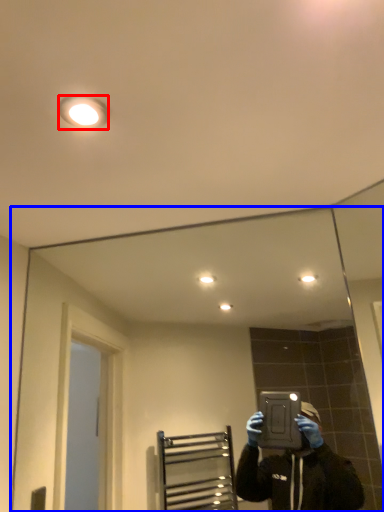
Question: Which object appears farthest to the camera in this image, light fixture (highlighted by a red box) or mirror (highlighted by a blue box)?

Choices:
 (A) light fixture
 (B) mirror

Answer: (B)